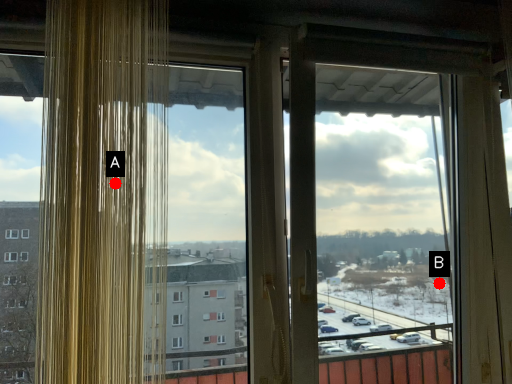
Question: Two points are circled on the image, labeled by A and B beside each circle. Which point is farther from the camera taking this photo?

Choices:
 (A) A is further
 (B) B is further

Answer: (B)